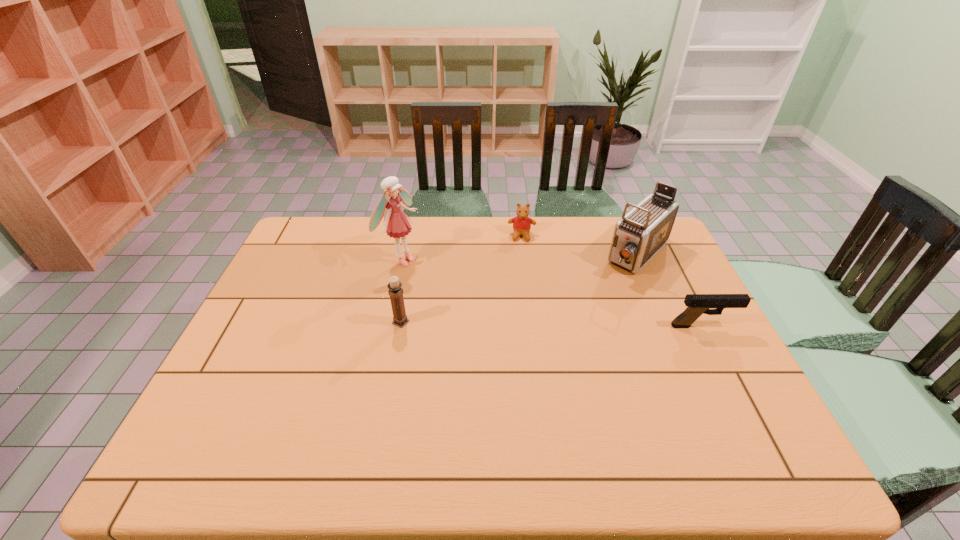
This screenshot has width=960, height=540. I want to click on free spot on the desktop that is between the candle holder and the pistol and is positioned at the lens of the camcorder, so click(569, 324).

Where is `free space on the desktop that is between the third shortest object and the pistol and is positioned on the front-facing side of the third object from left to right`? The width and height of the screenshot is (960, 540). free space on the desktop that is between the third shortest object and the pistol and is positioned on the front-facing side of the third object from left to right is located at coordinates (519, 323).

Find the location of a particular element. vacant space on the desktop that is between the candle holder and the pistol and is positioned on the front-facing side of the doll is located at coordinates (543, 324).